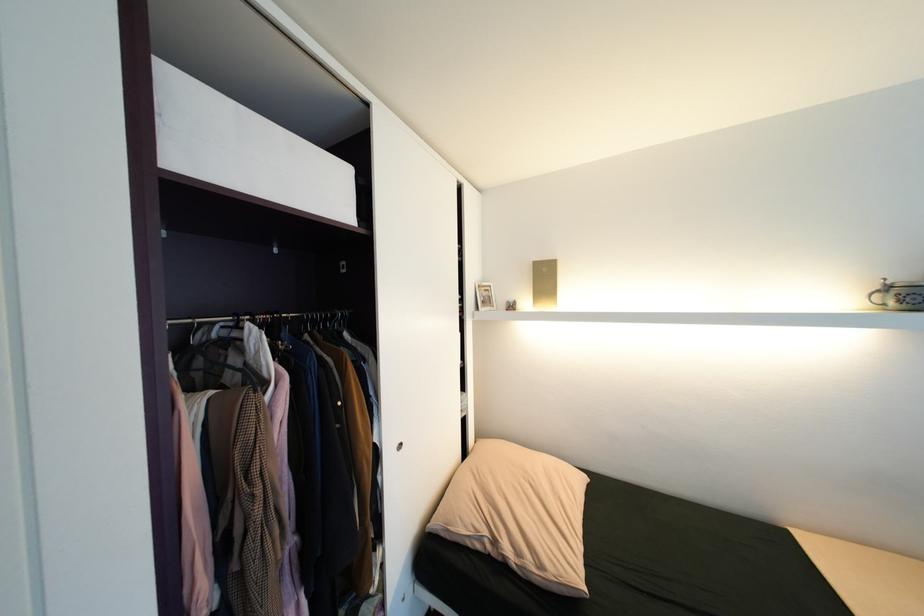
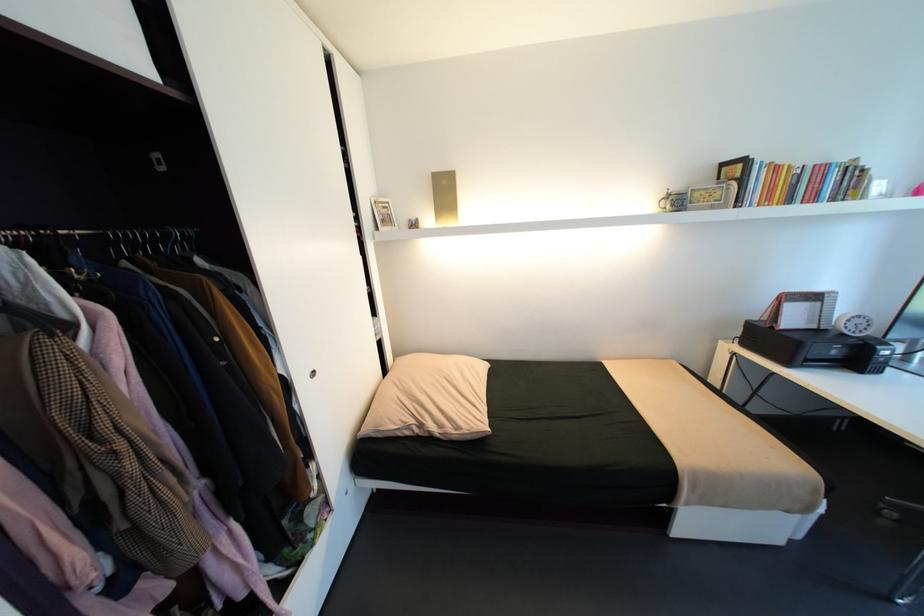
Question: The images are taken continuously from a first-person perspective. In which direction are you moving?

Choices:
 (A) Left
 (B) Right
 (C) Forward
 (D) Backward

Answer: (D)